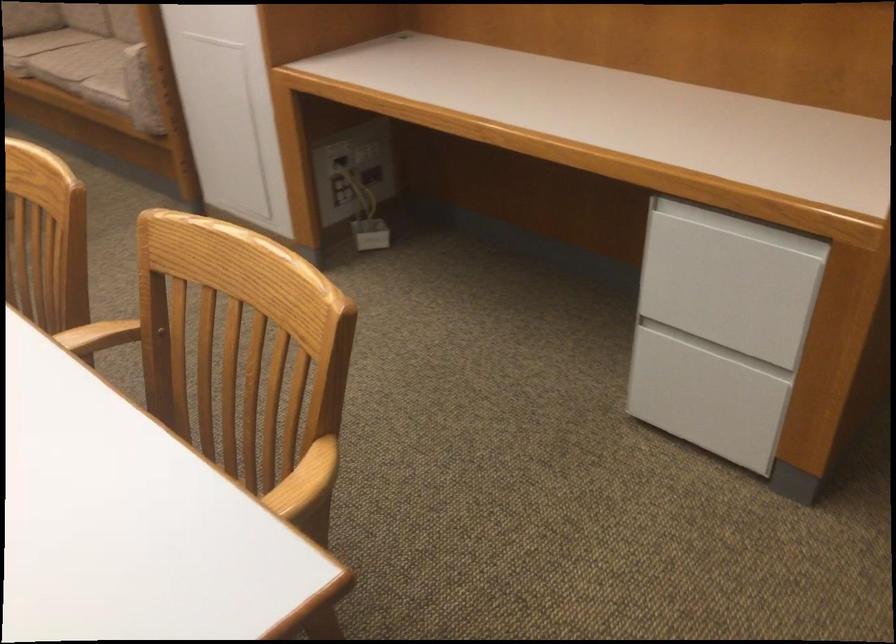
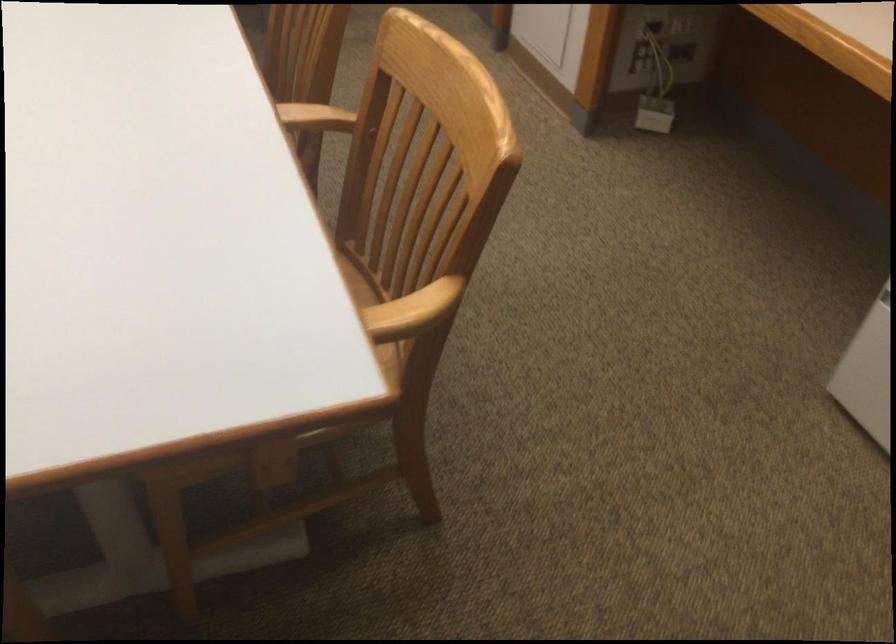
Question: Based on the continuous images, in which direction is the camera rotating? Reply with the corresponding letter.

Choices:
 (A) Left
 (B) Right
 (C) Up
 (D) Down

Answer: (A)